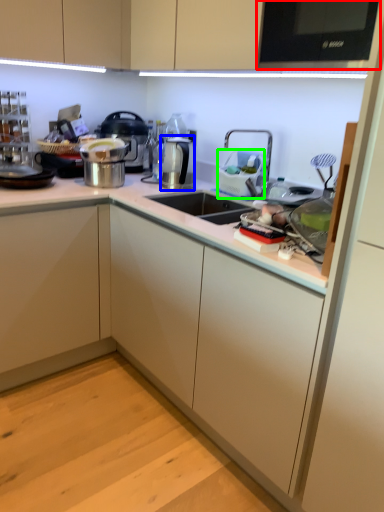
Question: Considering the real-world distances, which object is farthest from home appliance (highlighted by a red box)? appliance (highlighted by a blue box) or appliance (highlighted by a green box)?

Choices:
 (A) appliance
 (B) appliance

Answer: (A)